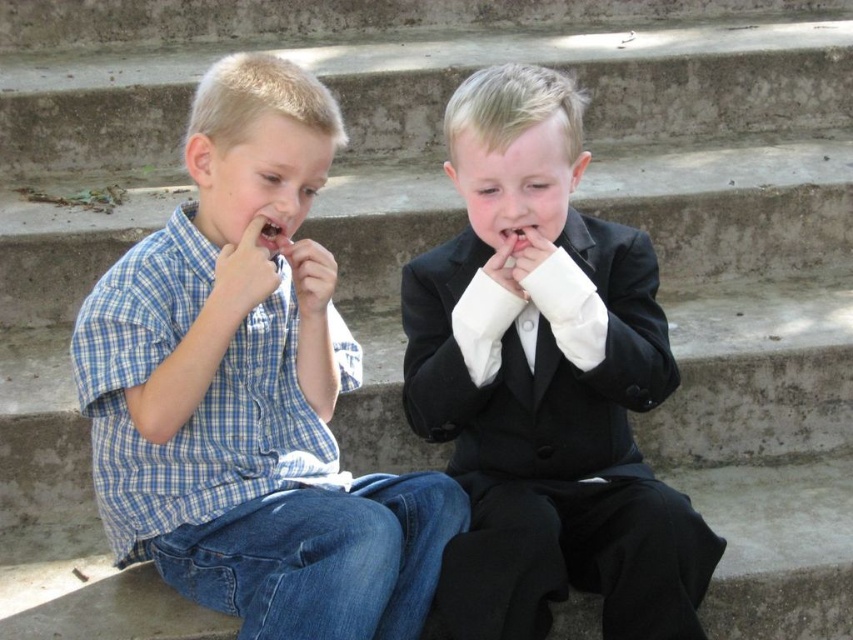
You are a photographer trying to capture a candid shot of the two boys. You want to ensure that the shiny black suit at center and the pink flesh at center are both visible in the frame. Based on their positions, which object is closer to the bottom edge of the photo?

The shiny black suit at center is located below the pink flesh at center, so the shiny black suit at center is closer to the bottom edge of the photo.

You are a photographer trying to capture both the blue plaid shirt at left and the shiny black suit at center in a single shot. Based on their heights, which one might you need to adjust your camera angle for to ensure both are fully visible?

The blue plaid shirt at left is not as tall as the shiny black suit at center, so you might need to lower your camera angle slightly to ensure the taller shiny black suit at center is fully visible while still capturing the shorter blue plaid shirt at left in the frame.

Based on the scene described, which object at the center has a greater height between the smooth white teeth at center and the pink flesh at center?

The smooth white teeth at center has a greater height compared to the pink flesh at center.